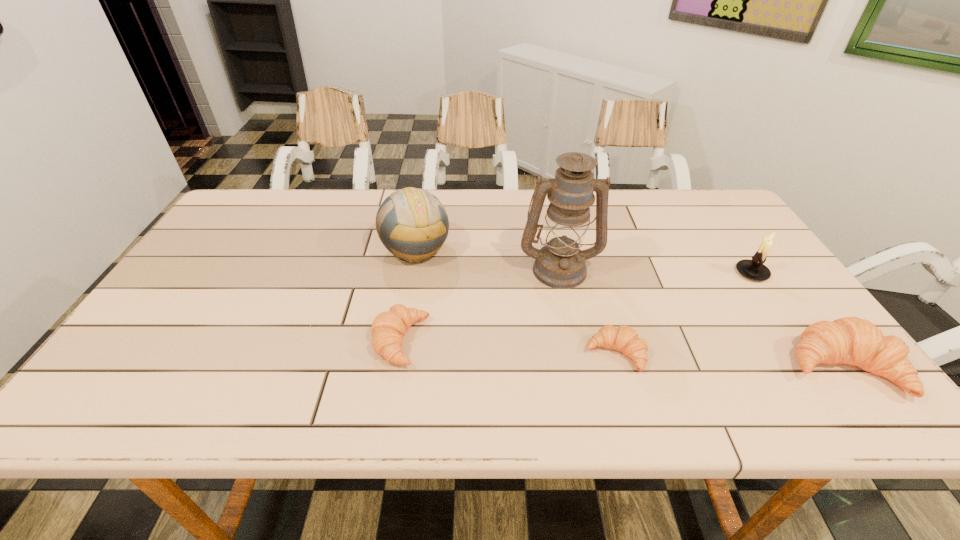
The height and width of the screenshot is (540, 960). Identify the location of free space at the near edge of the desktop. (627, 366).

What are the coordinates of `vacant position at the right edge of the desktop` in the screenshot? It's located at (714, 233).

In the image, there is a desktop. Identify the location of vacant space at the far left corner. This screenshot has height=540, width=960. pyautogui.click(x=272, y=206).

Locate an element on the screen. vacant space at the far right corner of the desktop is located at coordinates (675, 200).

The image size is (960, 540). What are the coordinates of `unoccupied area between the second tallest crescent roll and the tallest object` in the screenshot? It's located at (480, 305).

The height and width of the screenshot is (540, 960). In order to click on empty location between the second shortest object and the oil lamp in this screenshot , I will do `click(480, 305)`.

At what (x,y) coordinates should I click in order to perform the action: click on free space between the tallest crescent roll and the volleyball. Please return your answer as a coordinate pair (x, y). The image size is (960, 540). Looking at the image, I should click on (629, 308).

Locate an element on the screen. This screenshot has height=540, width=960. vacant region between the tallest crescent roll and the shortest object is located at coordinates (729, 361).

The height and width of the screenshot is (540, 960). I want to click on vacant region between the candle holder and the rightmost crescent roll, so click(x=797, y=320).

Find the location of a particular element. The height and width of the screenshot is (540, 960). free space between the candle holder and the tallest object is located at coordinates (656, 271).